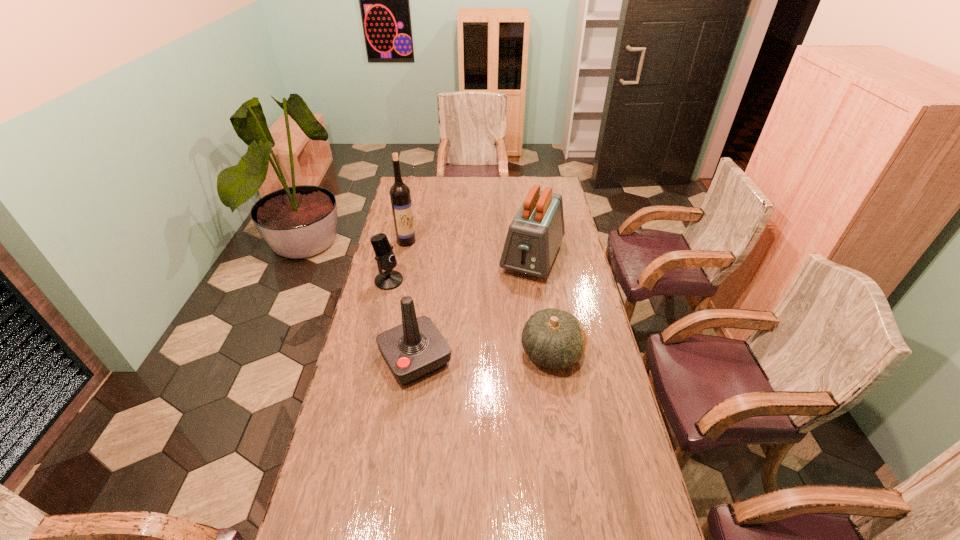
Where is `toaster present at the right edge`? The width and height of the screenshot is (960, 540). toaster present at the right edge is located at coordinates (534, 236).

Find the location of a particular element. The width and height of the screenshot is (960, 540). free region at the far edge of the desktop is located at coordinates (451, 184).

Identify the location of vacant space at the near edge of the desktop. (435, 517).

Find the location of a particular element. free space at the left edge of the desktop is located at coordinates (395, 326).

At what (x,y) coordinates should I click in order to perform the action: click on vacant space at the right edge of the desktop. Please return your answer as a coordinate pair (x, y). This screenshot has width=960, height=540. Looking at the image, I should click on (583, 412).

Image resolution: width=960 pixels, height=540 pixels. In the image, there is a desktop. What are the coordinates of `free space at the near left corner` in the screenshot? It's located at (328, 536).

The height and width of the screenshot is (540, 960). In order to click on unoccupied position between the toaster and the shortest object in this screenshot , I will do `click(542, 305)`.

This screenshot has height=540, width=960. Find the location of `free spot between the wine bottle and the toaster`. free spot between the wine bottle and the toaster is located at coordinates (469, 249).

Locate an element on the screen. empty location between the wine bottle and the second shortest object is located at coordinates (397, 261).

Find the location of a particular element. This screenshot has width=960, height=540. vacant area that lies between the gourd and the tallest object is located at coordinates (479, 297).